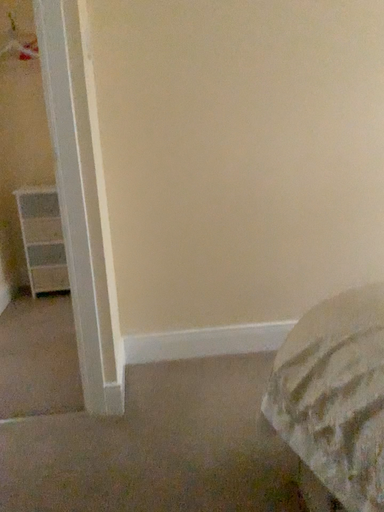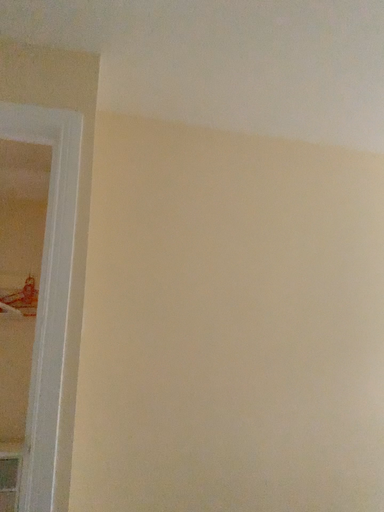
Question: Which way did the camera rotate in the video?

Choices:
 (A) rotated upward
 (B) rotated downward

Answer: (A)